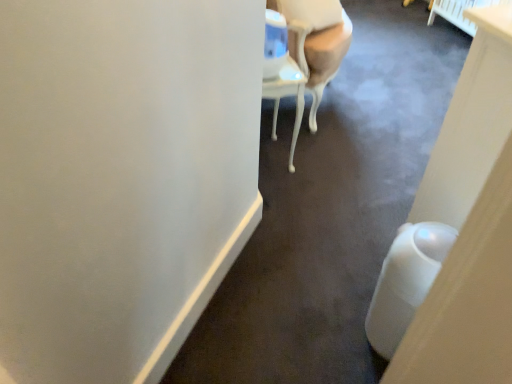
The image size is (512, 384). Describe the element at coordinates (319, 42) in the screenshot. I see `white glossy chair at upper center` at that location.

Where is `white glossy chair at upper center`? white glossy chair at upper center is located at coordinates (319, 42).

Where is `white glossy chair at upper center`? Image resolution: width=512 pixels, height=384 pixels. white glossy chair at upper center is located at coordinates (319, 42).